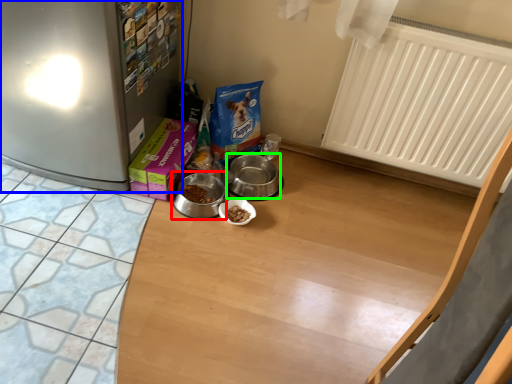
Question: Estimate the real-world distances between objects in this image. Which object is farther from appliance (highlighted by a red box), fridge (highlighted by a blue box) or appliance (highlighted by a green box)?

Choices:
 (A) fridge
 (B) appliance

Answer: (A)